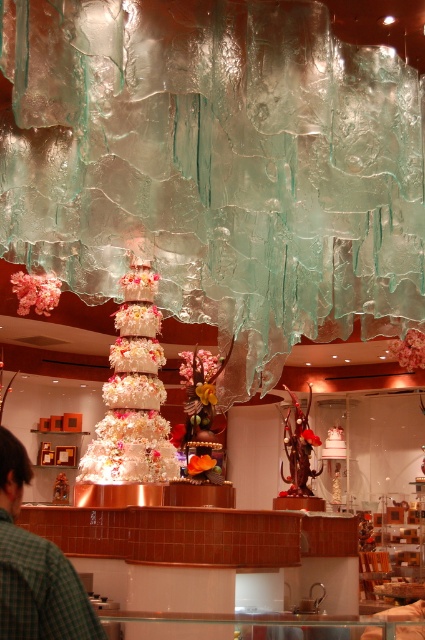
You are standing in the bakery and want to take a photo of the multi tiered cake. You notice two points marked in the scene. The first point is at coordinate point (79, 474) and the second is at point (64, 604). Which point is closer to your camera lens when focusing on the cake?

Point (79, 474) is further to the camera than point (64, 604). Therefore, the point closer to your camera lens would be point (64, 604) since it is nearer to the camera compared to the other point.

You are a customer looking to take a photo of the white textured cake at center. However, there is a green checkered shirt at lower left in the frame. Considering their sizes, which object should you focus on to ensure the cake is the main subject?

The white textured cake at center is larger in size compared to the green checkered shirt at lower left. To ensure the cake is the main subject, focus on the white textured cake at center as it occupies more space in the frame.

You are a customer entering the bakery and see the white textured cake at center and the green checkered shirt at lower left. Which object is positioned more to the right side of the scene?

The green checkered shirt at lower left is positioned more to the right side of the scene than the white textured cake at center.